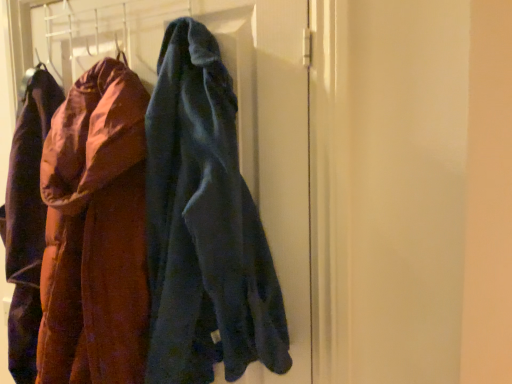
The image size is (512, 384). I want to click on velvet-like dark blue coat at center, so click(237, 117).

The width and height of the screenshot is (512, 384). What do you see at coordinates (237, 117) in the screenshot?
I see `velvet-like dark blue coat at center` at bounding box center [237, 117].

Identify the location of velvet-like dark blue coat at center. This screenshot has width=512, height=384. (237, 117).